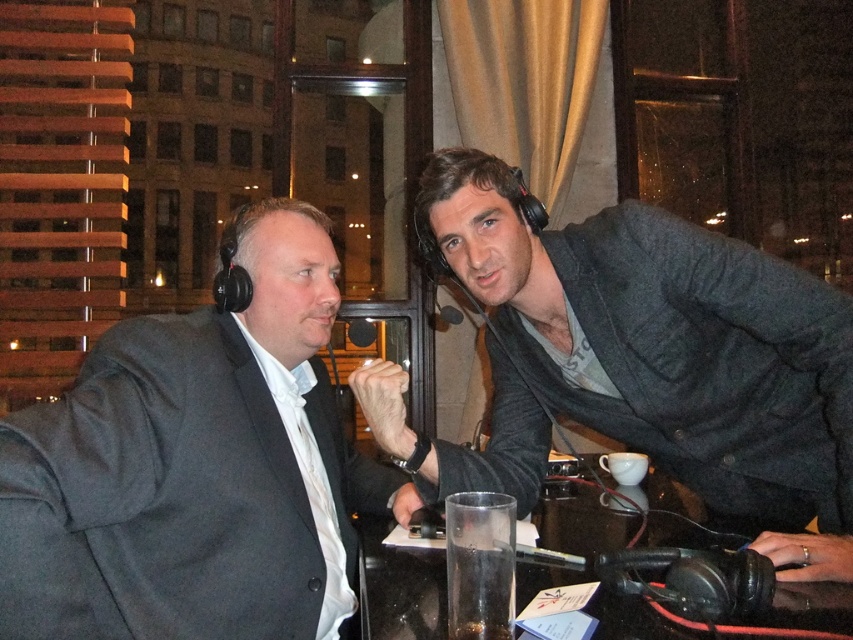
Question: Is matte black suit at left thinner than clear glass at center?

Choices:
 (A) yes
 (B) no

Answer: (B)

Question: Which object is the farthest from the dark gray textured blazer at right?

Choices:
 (A) transparent glass at center
 (B) clear glass at center

Answer: (B)

Question: Among these objects, which one is farthest from the camera?

Choices:
 (A) transparent glass at center
 (B) clear glass at center

Answer: (A)

Question: Which point appears farthest from the camera in this image?

Choices:
 (A) click(281, 616)
 (B) click(496, 564)
 (C) click(811, 291)
 (D) click(380, 616)

Answer: (C)

Question: Can you confirm if dark gray textured blazer at right is positioned to the left of clear glass at center?

Choices:
 (A) yes
 (B) no

Answer: (B)

Question: Is matte black suit at left above transparent glass at center?

Choices:
 (A) no
 (B) yes

Answer: (B)